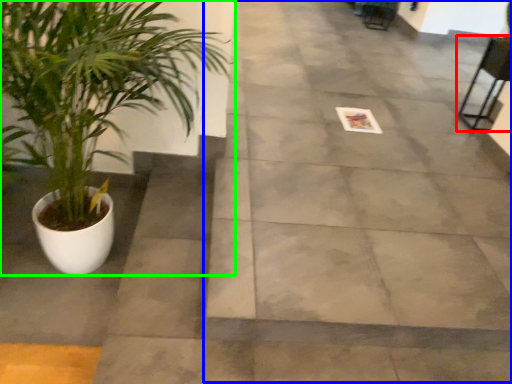
Question: Which object is positioned farthest from chair (highlighted by a red box)? Select from pavement (highlighted by a blue box) and houseplant (highlighted by a green box).

Choices:
 (A) pavement
 (B) houseplant

Answer: (B)